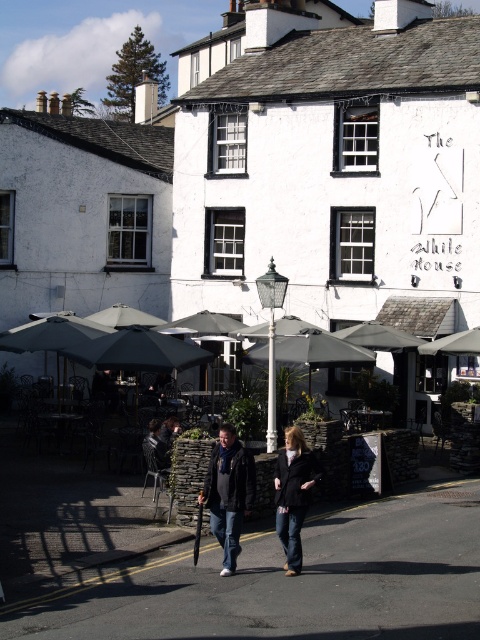
You are a photographer trying to capture a photo of the two people in front of The White House. You want to ensure both the dark blue jeans at center and the dark grey fabric umbrella at left are clearly visible in the frame. Given their sizes, which object should you focus on to ensure both are in focus?

The dark blue jeans at center is larger than the dark grey fabric umbrella at left, so focusing on the dark blue jeans at center will help ensure both are in focus as it is the larger object.

You are standing at the entrance of The White House and want to walk towards the person in the black jacket and jeans. Which of the two points, point [297,548] or point [371,355], should you head towards?

You should head towards point [297,548] because it is in front of point [371,355], meaning it is closer to your current position at the entrance of The White House.